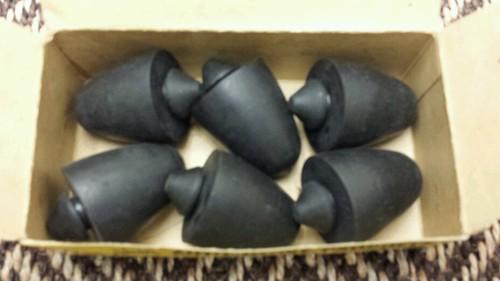
This screenshot has height=281, width=500. In order to click on right side of cardboard box in this screenshot , I will do `click(442, 155)`.